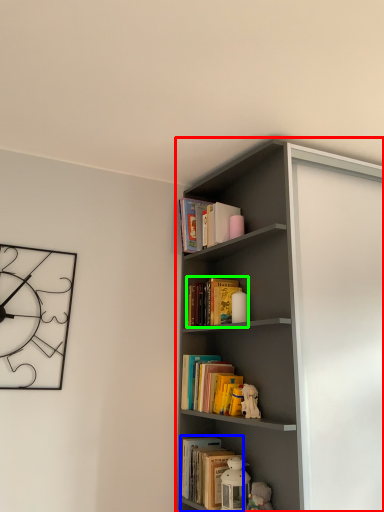
Question: Which object is the farthest from shelf (highlighted by a red box)? Choose among these: book (highlighted by a blue box) or book (highlighted by a green box).

Choices:
 (A) book
 (B) book

Answer: (A)